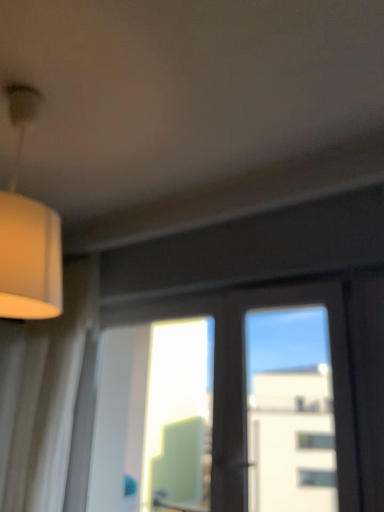
Looking at this image, measure the distance between transparent glass window at center and camera.

The distance of transparent glass window at center from camera is 1.46 meters.

Identify the location of transparent glass window at center. (226, 404).

Describe the element at coordinates (226, 404) in the screenshot. Image resolution: width=384 pixels, height=512 pixels. I see `transparent glass window at center` at that location.

The width and height of the screenshot is (384, 512). Identify the location of transparent glass window at center. (226, 404).